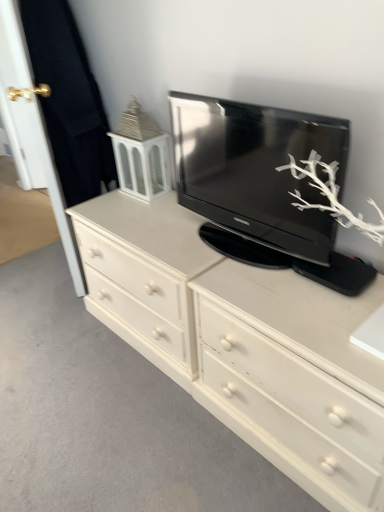
Question: In the image, is white painted wood tv cabinet at upper left on the left side or the right side of white matte drawer at center?

Choices:
 (A) left
 (B) right

Answer: (A)

Question: Is white painted wood tv cabinet at upper left in front of or behind white matte drawer at center in the image?

Choices:
 (A) behind
 (B) front

Answer: (A)

Question: Which object is the closest to the white matte drawer at center?

Choices:
 (A) gold metallic door handle at upper left, which is counted as the second door, starting from the right
 (B) white wood door at left, arranged as the second door when viewed from the left
 (C) white painted wood chest of drawers at center
 (D) black glossy television at center
 (E) white painted wood tv cabinet at upper left

Answer: (C)

Question: Which is farther from the gold metallic door handle at upper left, the first door when ordered from left to right?

Choices:
 (A) white painted wood chest of drawers at center
 (B) black glossy television at center
 (C) white wood door at left, which is counted as the first door, starting from the right
 (D) white painted wood tv cabinet at upper left
 (E) white matte drawer at center

Answer: (E)